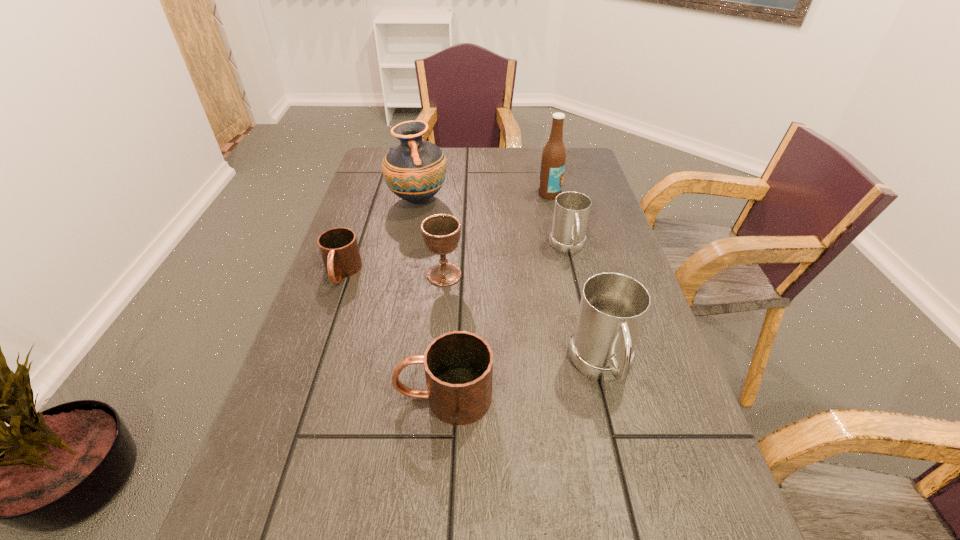
The height and width of the screenshot is (540, 960). What are the coordinates of `mug at the left edge` in the screenshot? It's located at (x=339, y=250).

Identify the location of beer bottle positioned at the right edge. This screenshot has height=540, width=960. [x=553, y=160].

The height and width of the screenshot is (540, 960). What are the coordinates of `vacant area at the far edge of the desktop` in the screenshot? It's located at (460, 148).

At what (x,y) coordinates should I click in order to perform the action: click on free space at the left edge. Please return your answer as a coordinate pair (x, y). Looking at the image, I should click on (300, 401).

Where is `vacant position at the right edge of the desktop`? vacant position at the right edge of the desktop is located at coordinates (684, 421).

In the image, there is a desktop. Where is `vacant space at the far right corner`? vacant space at the far right corner is located at coordinates (585, 150).

Where is `free space between the pottery and the farther gray mug`? The width and height of the screenshot is (960, 540). free space between the pottery and the farther gray mug is located at coordinates (493, 224).

I want to click on vacant area that lies between the chalice and the farther gray mug, so click(506, 261).

Locate an element on the screen. The image size is (960, 540). vacant space that's between the smaller gray mug and the chalice is located at coordinates (506, 261).

Where is `free area in between the smaller gray mug and the right rust mug`? The height and width of the screenshot is (540, 960). free area in between the smaller gray mug and the right rust mug is located at coordinates (506, 322).